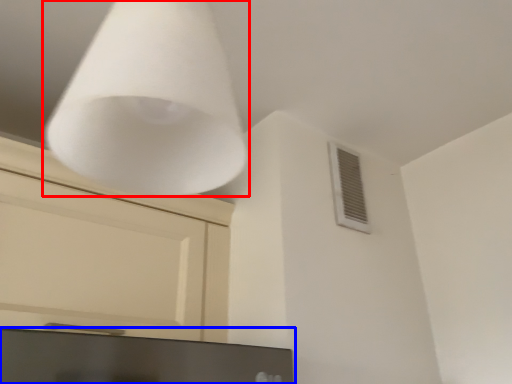
Question: Which of the following is the closest to the observer, lamp (highlighted by a red box) or computer monitor (highlighted by a blue box)?

Choices:
 (A) lamp
 (B) computer monitor

Answer: (A)